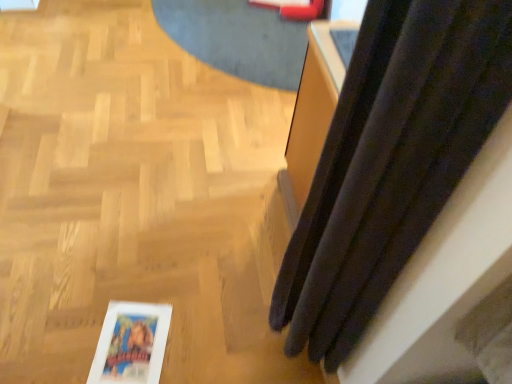
Where is `white glossy magazine at lower left`? The width and height of the screenshot is (512, 384). white glossy magazine at lower left is located at coordinates (131, 344).

The width and height of the screenshot is (512, 384). What do you see at coordinates (131, 344) in the screenshot? I see `white glossy magazine at lower left` at bounding box center [131, 344].

In order to click on white glossy magazine at lower left in this screenshot , I will do `click(131, 344)`.